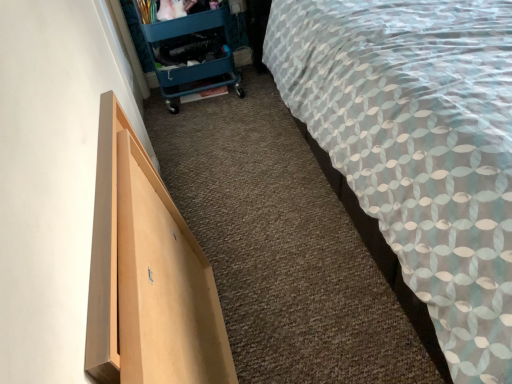
Question: Looking at their shapes, would you say teal plastic trolley at upper left is wider or thinner than light wood drawer at left?

Choices:
 (A) thin
 (B) wide

Answer: (B)

Question: In the image, is teal plastic trolley at upper left on the left side or the right side of light wood drawer at left?

Choices:
 (A) left
 (B) right

Answer: (A)

Question: Based on their relative distances, which object is farther from the teal plastic trolley at upper left?

Choices:
 (A) light wood drawer at left
 (B) patterned fabric bed at right

Answer: (A)

Question: Which object is the farthest from the teal plastic trolley at upper left?

Choices:
 (A) patterned fabric bed at right
 (B) light wood drawer at left

Answer: (B)